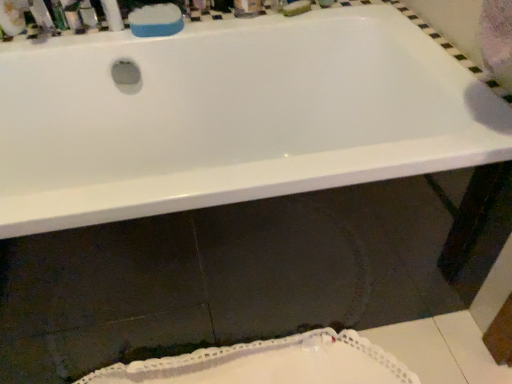
Question: Looking at their shapes, would you say white glossy bathtub at upper center is wider or thinner than blue sponge at upper center?

Choices:
 (A) wide
 (B) thin

Answer: (A)

Question: From their relative heights in the image, would you say white glossy bathtub at upper center is taller or shorter than blue sponge at upper center?

Choices:
 (A) tall
 (B) short

Answer: (A)

Question: Estimate the real-world distances between objects in this image. Which object is closer to the metallic silver soap at upper left, the third toiletry viewed from the right?

Choices:
 (A) white plastic mouthwash at upper left
 (B) white glossy bathtub at upper center
 (C) blue sponge at upper center
 (D) white lace doily at lower center
 (E) metallic silver container at upper left, which is the 3th toiletry from left to right

Answer: (E)

Question: Which of these objects is positioned farthest from the white plastic mouthwash at upper left?

Choices:
 (A) metallic silver container at upper left, which is the 3th toiletry from left to right
 (B) white glossy bathtub at upper center
 (C) blue sponge at upper center
 (D) matte plastic toothbrush at upper left, the 2th toiletry in the left-to-right sequence
 (E) metallic silver soap at upper left, which is counted as the first toiletry, starting from the left

Answer: (B)